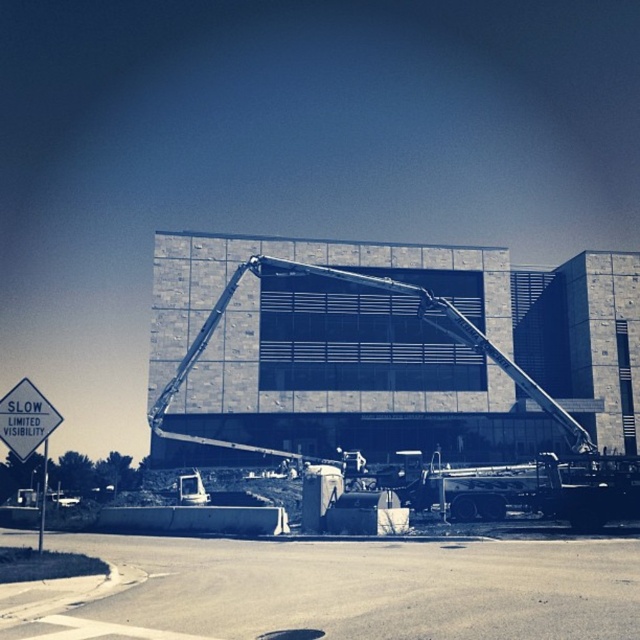
Which of these two, metallic gray crane at center or white plastic sign at upper left, stands shorter?

With less height is white plastic sign at upper left.

Where is `metallic gray crane at center`? The image size is (640, 640). metallic gray crane at center is located at coordinates (364, 285).